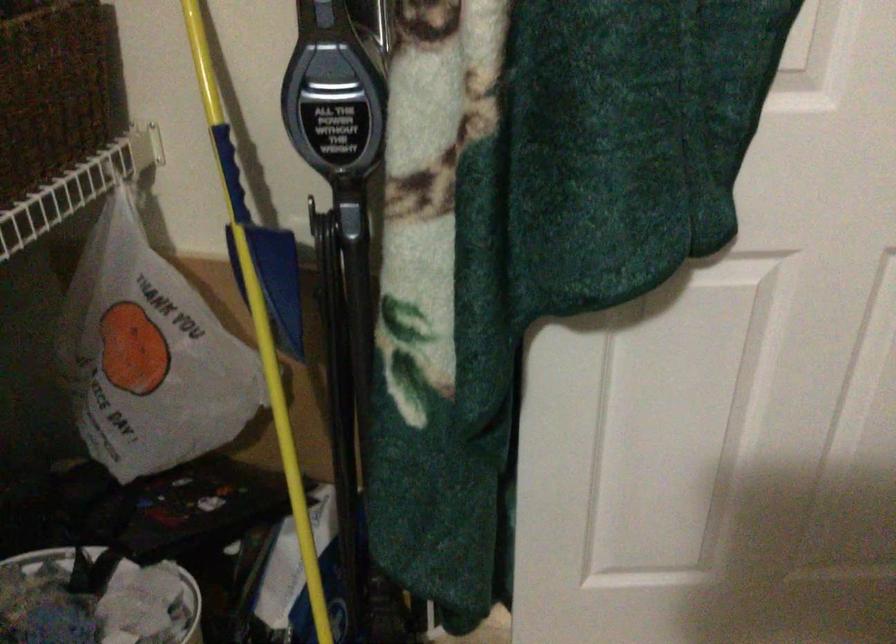
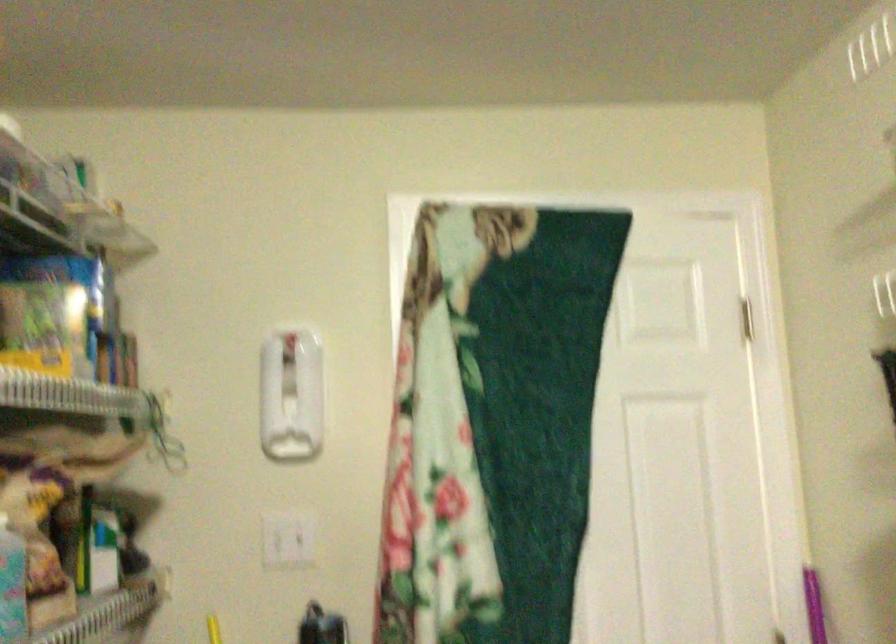
The first image is from the beginning of the video and the second image is from the end. How did the camera likely rotate when shooting the video?

The camera rotated toward right-up.